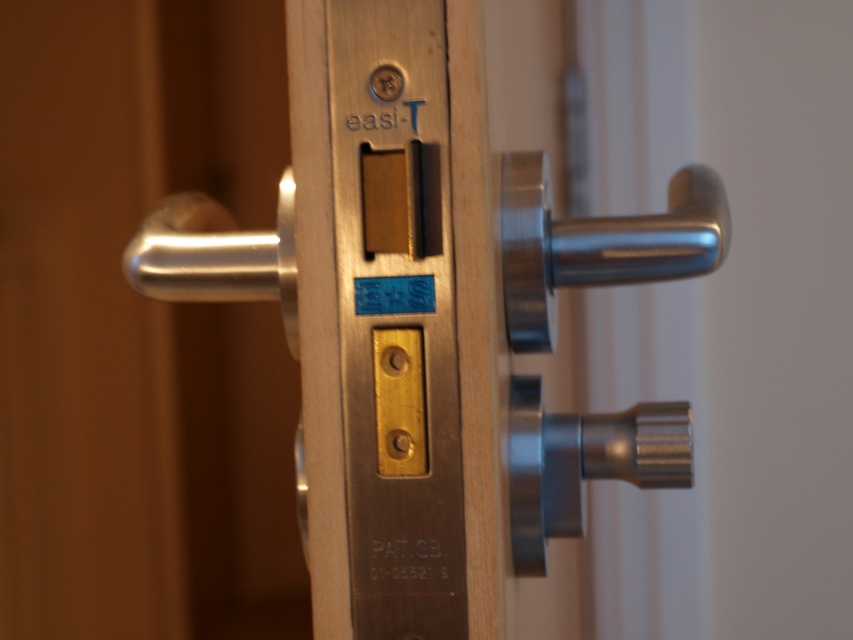
You are trying to open the door and see the satin metal knob at lower right and the satin silver handle at left. Which one is closer to you?

The satin metal knob at lower right is closer to you because the satin silver handle at left is behind it.

You are trying to open the door and see the satin nickel handle at center right and the satin silver handle at left. Which handle should you pull first based on their positions?

The satin nickel handle at center right is in front of the satin silver handle at left, so you should pull the satin nickel handle first as it is closer to you.

In the scene shown: You are trying to locate the satin nickel handle at center right on the door lock. What are the coordinates where you should look?

The satin nickel handle at center right is located at coordinates point (x=596, y=243).